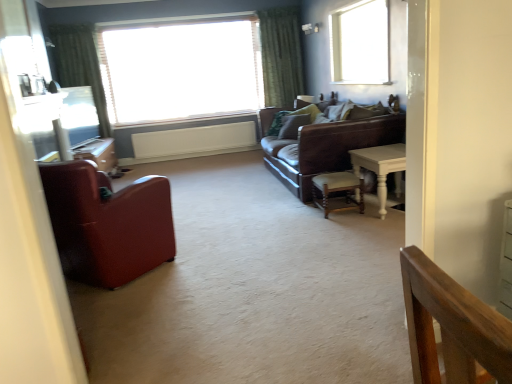
Question: Considering the positions of transparent glass window at upper right, positioned as the second window in left-to-right order, and matte glass window screen at left in the image, is transparent glass window at upper right, positioned as the second window in left-to-right order, taller or shorter than matte glass window screen at left?

Choices:
 (A) short
 (B) tall

Answer: (B)

Question: Visually, is transparent glass window at upper right, the 1th window viewed from the right, positioned to the left or to the right of matte glass window screen at left?

Choices:
 (A) right
 (B) left

Answer: (A)

Question: Which is farther from the green fabric curtain at upper left, which appears as the first curtain when viewed from the left?

Choices:
 (A) white blinds at upper center, which is counted as the first window, starting from the back
 (B) transparent glass window at upper right, the 1th window viewed from the right
 (C) white wooden table at right
 (D) matte glass window screen at left
 (E) leather armchair at left, placed as the first chair when sorted from left to right

Answer: (C)

Question: Estimate the real-world distances between objects in this image. Which object is farther from the brown leather couch at center?

Choices:
 (A) green textured curtain at upper center, positioned as the 1th curtain in right-to-left order
 (B) transparent glass window at upper right, the 2th window viewed from the back
 (C) wooden chair at center, which is the second chair from left to right
 (D) green fabric curtain at upper left, which appears as the first curtain when viewed from the left
 (E) white wooden table at right

Answer: (D)